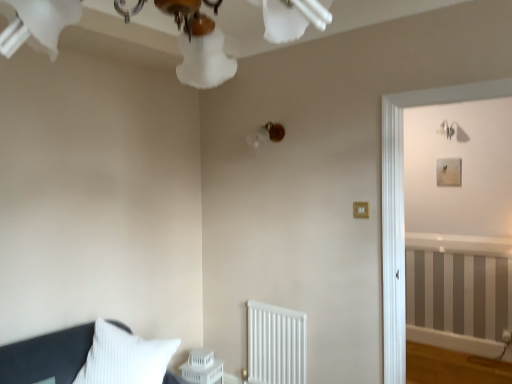
Identify the location of vacant area on top of white plastic table at lower center (from a real-world perspective). (198, 359).